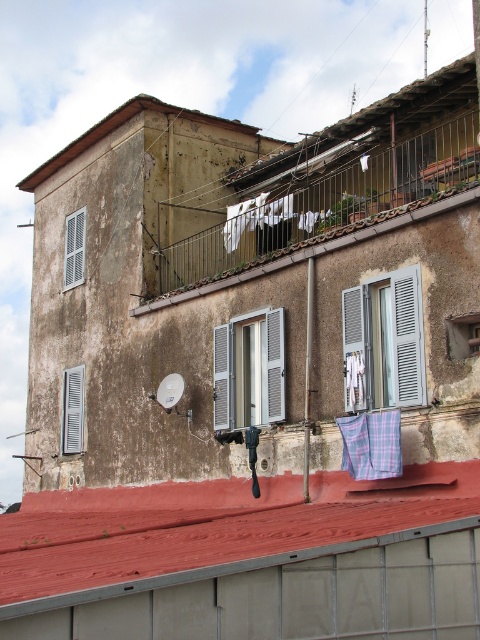
Which is more to the right, white matte window at center or weathered concrete roof at upper center?

white matte window at center is more to the right.

Who is lower down, white matte window at center or weathered concrete roof at upper center?

white matte window at center

What do you see at coordinates (250, 371) in the screenshot? I see `white matte window at center` at bounding box center [250, 371].

The image size is (480, 640). Find the location of `white matte window at center`. white matte window at center is located at coordinates (250, 371).

Who is higher up, red corrugated metal at upper center or white matte window at center?

Positioned higher is white matte window at center.

Between point (79, 531) and point (217, 340), which one is positioned in front?

Point (79, 531) is in front.

Where is `red corrugated metal at upper center`? The width and height of the screenshot is (480, 640). red corrugated metal at upper center is located at coordinates (248, 557).

Is rusty corrugated metal roof at upper center above white matte window at center?

Yes, rusty corrugated metal roof at upper center is above white matte window at center.

Does point (385, 120) come in front of point (265, 381)?

That is False.

Find the location of a particular element. The height and width of the screenshot is (640, 480). rusty corrugated metal roof at upper center is located at coordinates (365, 131).